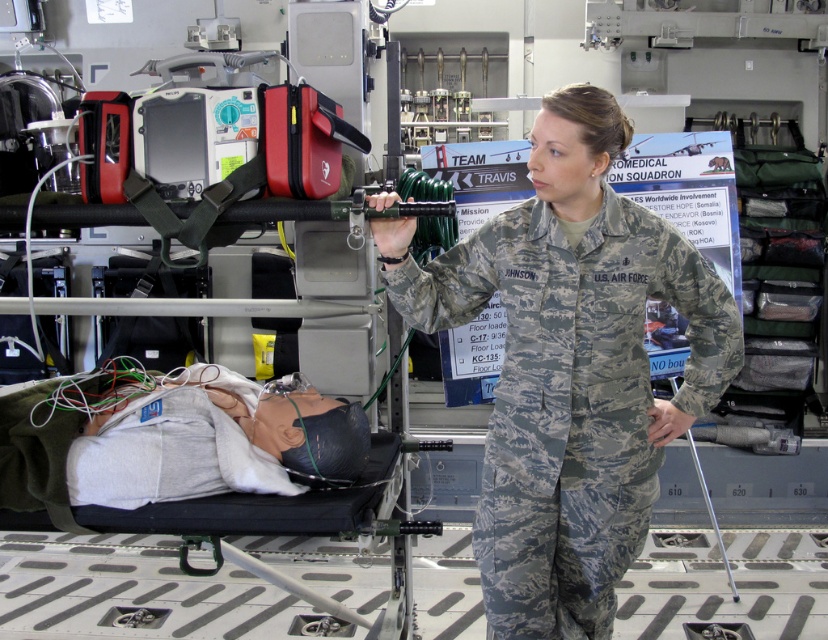
You are a medical trainee in this scenario. You need to quickly assess the space between the camouflage uniform at center and the camouflage fabric stretcher at center to determine if a medical kit can fit. The medical kit is 10 cm thick. Can it fit?

The camouflage uniform at center is thinner than the camouflage fabric stretcher at center, so the space between them is at least as thick as the uniform. Since the medical kit is 10 cm thick, it depends on the exact dimensions. However, since the stretcher is thicker, there might be enough space. But without specific measurements, we can infer that the space between them is sufficient because the uniform is thinner, so the kit can fit.

Based on the photo, you are a medical trainee in the scene. You need to access the medical supplies stored under the camouflage fabric stretcher at center. Can you reach them while the camouflage uniform at center is on top?

The camouflage uniform at center is located above the camouflage fabric stretcher at center, so you cannot reach the medical supplies stored underneath without moving the uniform first.

Looking at this image, you are a medical trainee in the scene and need to move the camouflage fabric stretcher at center closer to the camouflage uniform at center. How much distance do you need to cover to bring them together?

The camouflage uniform at center and camouflage fabric stretcher at center are 55.19 centimeters apart, so you need to move the stretcher 55.19 centimeters towards the camouflage uniform at center to bring them together.